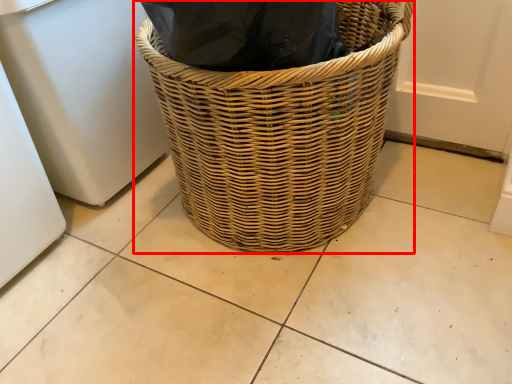
Question: Where is picnic basket (annotated by the red box) located in relation to appliance in the image?

Choices:
 (A) right
 (B) left

Answer: (A)